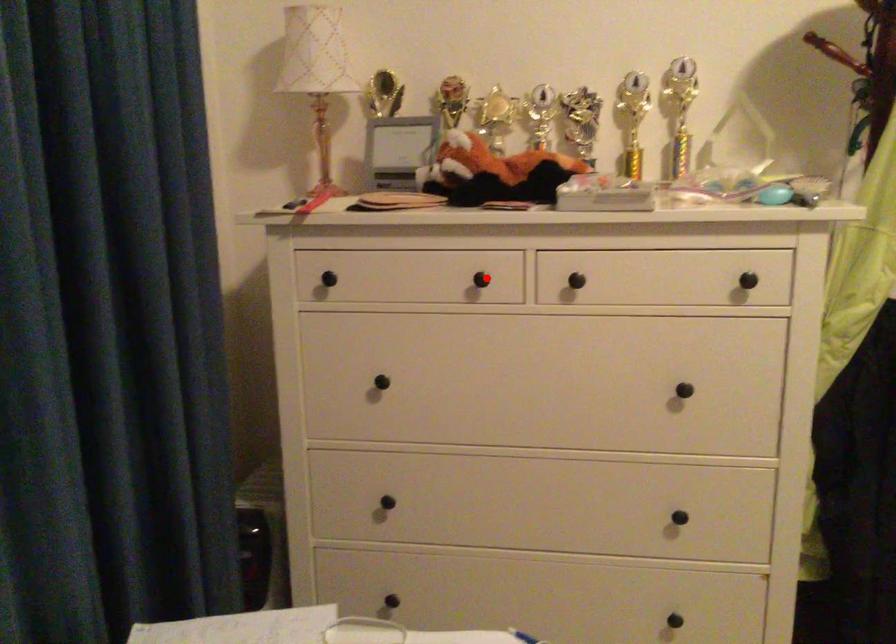
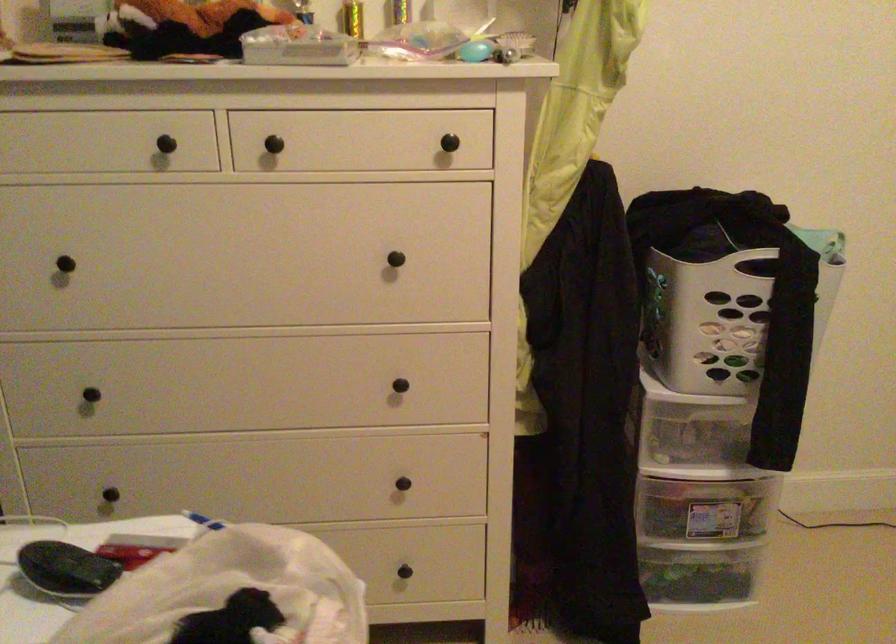
Question: A red point is marked in image1. In image2, is the corresponding 3D point closer to the camera or farther? Reply with the corresponding letter.

Choices:
 (A) The corresponding 3D point is closer.
 (B) The corresponding 3D point is farther.

Answer: (A)